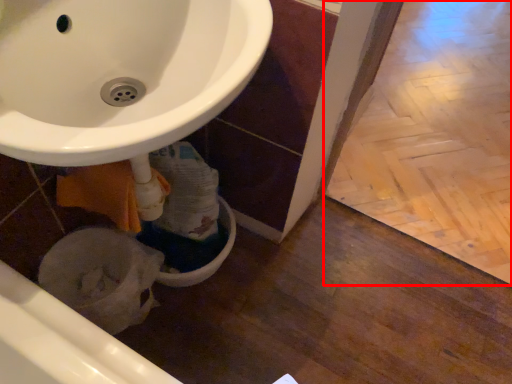
Question: From the image's perspective, what is the correct spatial relationship of tile (annotated by the red box) in relation to bidet?

Choices:
 (A) above
 (B) below

Answer: (A)